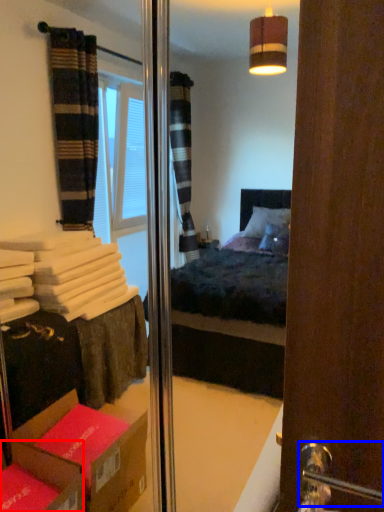
Question: Which object appears farthest to the camera in this image, cardboard box (highlighted by a red box) or door handle (highlighted by a blue box)?

Choices:
 (A) cardboard box
 (B) door handle

Answer: (A)